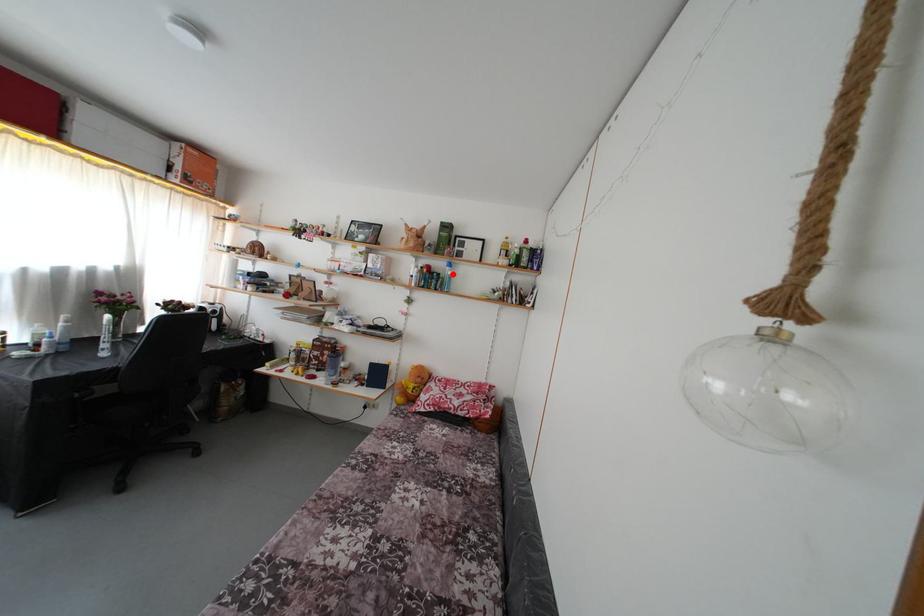
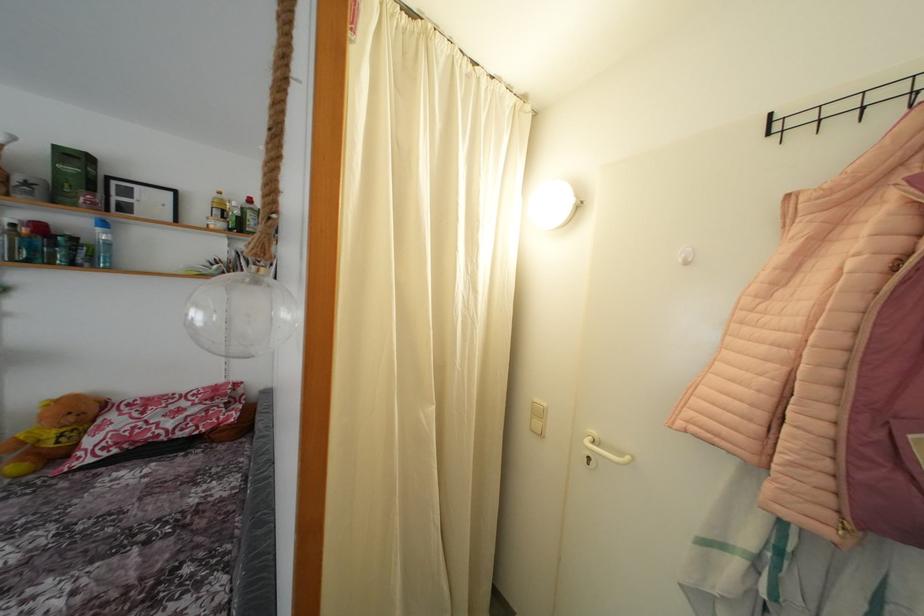
Locate, in the second image, the point that corresponds to the highlighted location in the first image.

(104, 236)